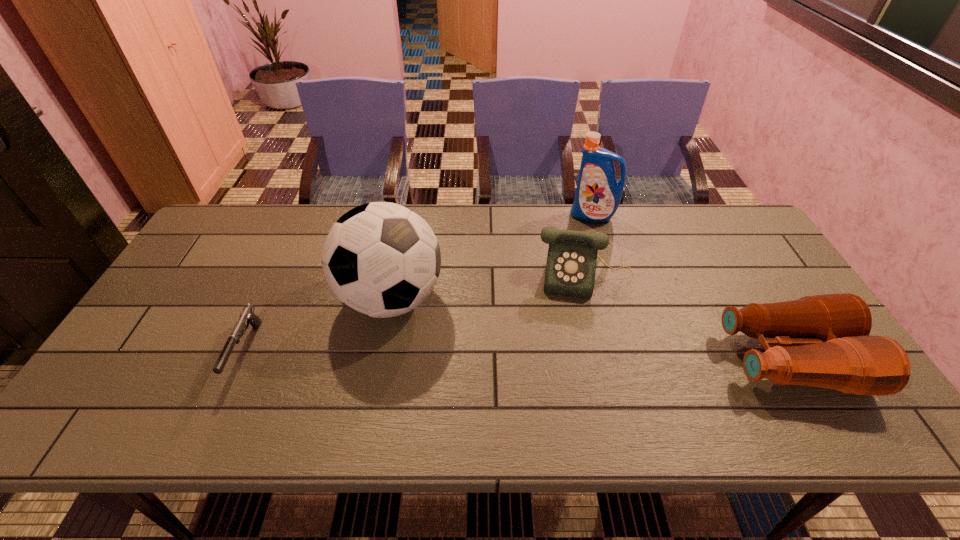
In the image, there is a desktop. Where is `free space at the far edge`? This screenshot has height=540, width=960. free space at the far edge is located at coordinates (672, 246).

Locate an element on the screen. vacant space at the near edge is located at coordinates (256, 384).

Locate an element on the screen. Image resolution: width=960 pixels, height=540 pixels. free space at the left edge of the desktop is located at coordinates (143, 341).

Identify the location of vacant area at the right edge of the desktop. This screenshot has width=960, height=540. (738, 284).

Locate an element on the screen. blank space at the far left corner of the desktop is located at coordinates (244, 229).

This screenshot has height=540, width=960. I want to click on free point at the near left corner, so click(108, 379).

The height and width of the screenshot is (540, 960). I want to click on vacant space that is in between the telephone and the gun, so [x=416, y=313].

Identify the location of vacant area between the fourth object from right to left and the telephone. Image resolution: width=960 pixels, height=540 pixels. (489, 288).

You are a GUI agent. You are given a task and a screenshot of the screen. Output one action in this format:
    pyautogui.click(x=<x>, y=<y>)
    Task: Click on the free space between the rightmost object and the farthest object
    
    Given the screenshot: What is the action you would take?
    pyautogui.click(x=690, y=288)

Where is `free spot between the leftmost object and the soccer ball`? The image size is (960, 540). free spot between the leftmost object and the soccer ball is located at coordinates (319, 325).